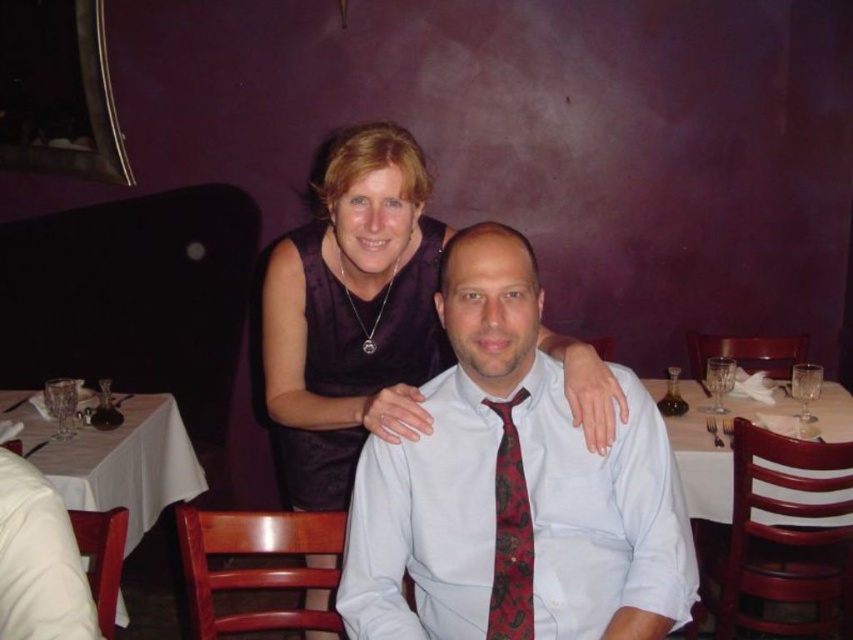
Locate an element on the screen. This screenshot has height=640, width=853. white satin shirt at center is located at coordinates (514, 490).

Between white satin shirt at center and white cloth at lower left, which one appears on the right side from the viewer's perspective?

white satin shirt at center is more to the right.

This screenshot has width=853, height=640. Describe the element at coordinates (514, 490) in the screenshot. I see `white satin shirt at center` at that location.

The width and height of the screenshot is (853, 640). Find the location of `white satin shirt at center`. white satin shirt at center is located at coordinates (514, 490).

Does white tablecloth at center have a larger size compared to red paisley fabric tie at center?

Yes, white tablecloth at center is bigger than red paisley fabric tie at center.

Is point (688, 397) less distant than point (505, 483)?

No, it is behind (505, 483).

Does point (720, 464) come closer to viewer compared to point (518, 561)?

That is False.

You are a GUI agent. You are given a task and a screenshot of the screen. Output one action in this format:
    pyautogui.click(x=<x>, y=<y>)
    Task: Click on the white tablecloth at center
    The height and width of the screenshot is (640, 853).
    Given the screenshot: What is the action you would take?
    click(x=712, y=449)

Which is below, white cloth at lower left or white tablecloth at center?

white cloth at lower left

Describe the element at coordinates (117, 460) in the screenshot. I see `white cloth at lower left` at that location.

At what (x,y) coordinates should I click in order to perform the action: click on white cloth at lower left. Please return your answer as a coordinate pair (x, y). Looking at the image, I should click on (117, 460).